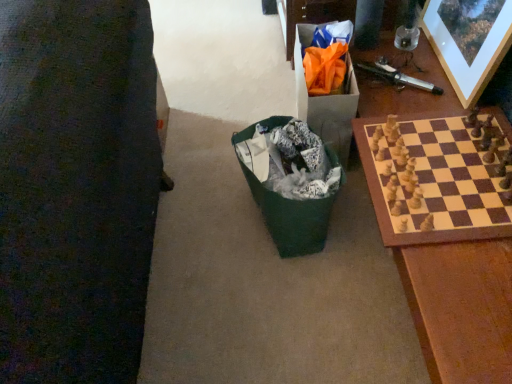
Question: Is orange paper bag at upper right completely or partially inside green fabric bag at center?

Choices:
 (A) yes
 (B) no

Answer: (B)

Question: Can you confirm if green fabric bag at center is smaller than orange paper bag at upper right?

Choices:
 (A) no
 (B) yes

Answer: (A)

Question: From a real-world perspective, is green fabric bag at center located higher than orange paper bag at upper right?

Choices:
 (A) no
 (B) yes

Answer: (A)

Question: Does green fabric bag at center come behind orange paper bag at upper right?

Choices:
 (A) yes
 (B) no

Answer: (B)

Question: Is green fabric bag at center closer to camera compared to orange paper bag at upper right?

Choices:
 (A) yes
 (B) no

Answer: (A)

Question: Considering the relative positions of green fabric bag at center and orange paper bag at upper right in the image provided, is green fabric bag at center to the right of orange paper bag at upper right from the viewer's perspective?

Choices:
 (A) no
 (B) yes

Answer: (A)

Question: Could wooden picture frame at upper right be considered to be inside green fabric bag at center?

Choices:
 (A) yes
 (B) no

Answer: (B)

Question: Is the position of green fabric bag at center more distant than that of wooden picture frame at upper right?

Choices:
 (A) yes
 (B) no

Answer: (A)

Question: Is green fabric bag at center in front of wooden picture frame at upper right?

Choices:
 (A) no
 (B) yes

Answer: (A)

Question: Is green fabric bag at center at the right side of wooden picture frame at upper right?

Choices:
 (A) yes
 (B) no

Answer: (B)

Question: Is green fabric bag at center at the left side of wooden picture frame at upper right?

Choices:
 (A) no
 (B) yes

Answer: (B)

Question: From the image's perspective, would you say green fabric bag at center is positioned over wooden picture frame at upper right?

Choices:
 (A) no
 (B) yes

Answer: (A)

Question: Is orange paper bag at upper right bigger than wooden picture frame at upper right?

Choices:
 (A) no
 (B) yes

Answer: (B)